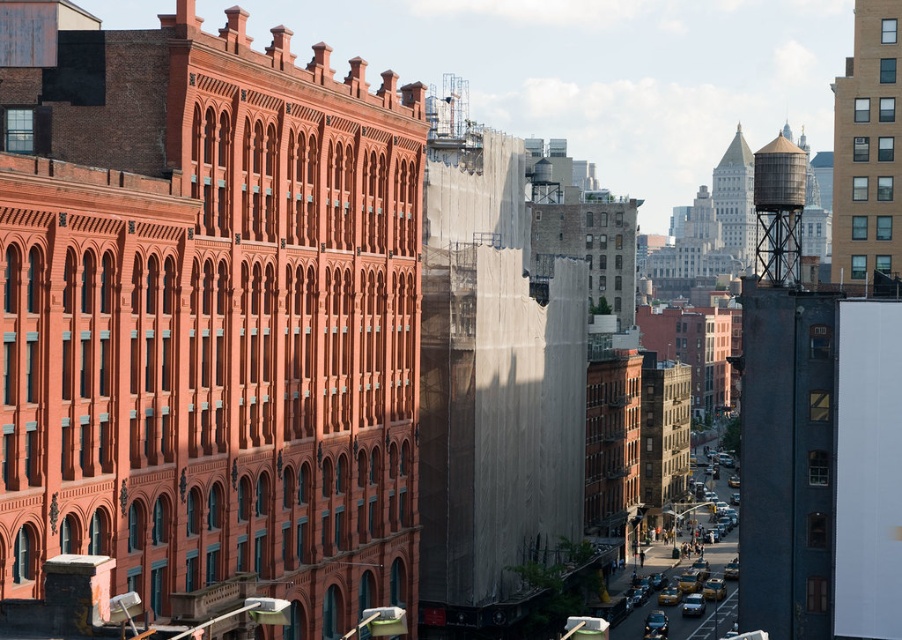
Between yellow matte taxi cab at center and shiny black sedan at center, which one is positioned higher?

shiny black sedan at center is higher up.

In the scene shown: Is yellow matte taxi cab at center further to the viewer compared to shiny black sedan at center?

No.

Who is more forward, (713, 566) or (693, 596)?

Point (693, 596) is more forward.

The height and width of the screenshot is (640, 902). In order to click on yellow matte taxi cab at center in this screenshot , I will do `click(668, 621)`.

Is metallic gray water tower at right smaller than rustic metal water tower at upper right?

Correct, metallic gray water tower at right occupies less space than rustic metal water tower at upper right.

Is metallic gray water tower at right in front of rustic metal water tower at upper right?

Yes.

At what (x,y) coordinates should I click in order to perform the action: click on metallic gray water tower at right. Please return your answer as a coordinate pair (x, y). The width and height of the screenshot is (902, 640). Looking at the image, I should click on (784, 419).

Can you confirm if metallic gray water tower at right is shorter than shiny black sedan at center?

No.

Is point (762, 481) positioned behind point (689, 609)?

No, (762, 481) is closer to viewer.

The image size is (902, 640). In order to click on metallic gray water tower at right in this screenshot , I will do `click(784, 419)`.